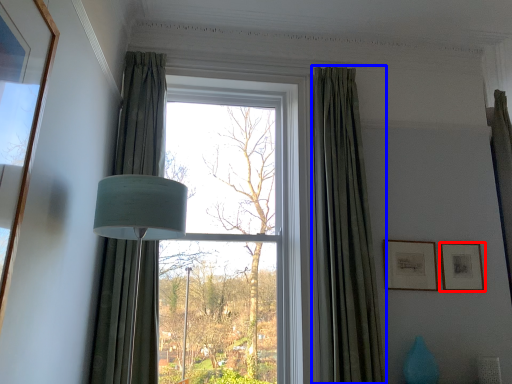
Question: Among these objects, which one is nearest to the camera, picture frame (highlighted by a red box) or curtain (highlighted by a blue box)?

Choices:
 (A) picture frame
 (B) curtain

Answer: (B)